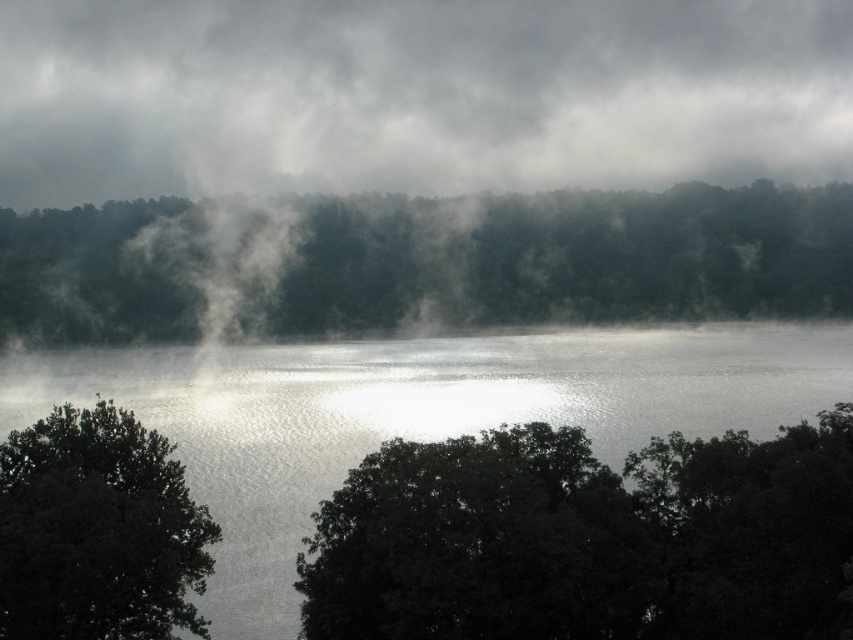
Question: Is gray fog at upper center to the left of green matte tree at center from the viewer's perspective?

Choices:
 (A) no
 (B) yes

Answer: (B)

Question: Does gray fog at upper center have a greater width compared to glistening water at center?

Choices:
 (A) no
 (B) yes

Answer: (B)

Question: Estimate the real-world distances between objects in this image. Which object is closer to the dark green leafy tree at lower left?

Choices:
 (A) glistening water at center
 (B) dark green leafy tree at lower center

Answer: (B)

Question: Which of these objects is positioned closest to the glistening water at center?

Choices:
 (A) dark green leafy tree at lower center
 (B) dark green leafy tree at lower left
 (C) gray fog at upper center

Answer: (A)

Question: Which of the following is the farthest from the observer?

Choices:
 (A) dark green leafy tree at lower center
 (B) glistening water at center

Answer: (B)

Question: In this image, where is gray fog at upper center located relative to green matte tree at center?

Choices:
 (A) below
 (B) above

Answer: (B)